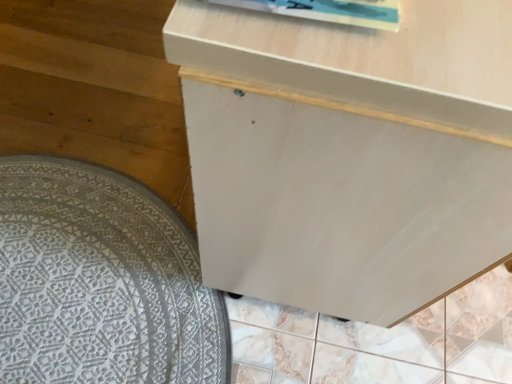
What do you see at coordinates (101, 282) in the screenshot?
I see `white textured mat at lower left` at bounding box center [101, 282].

Measure the distance between point (109, 172) and camera.

4.18 feet.

Locate an element on the screen. The height and width of the screenshot is (384, 512). white textured mat at lower left is located at coordinates (101, 282).

Describe the element at coordinates (348, 153) in the screenshot. I see `white matte cabinet at center` at that location.

Image resolution: width=512 pixels, height=384 pixels. I want to click on white matte cabinet at center, so click(348, 153).

What is the approximate width of white matte cabinet at center?

white matte cabinet at center is 19.67 inches in width.

Where is `white textured mat at lower left`? This screenshot has width=512, height=384. white textured mat at lower left is located at coordinates pos(101,282).

Is white matte cabinet at center at the left side of white textured mat at lower left?

No.

Is the position of white matte cabinet at center more distant than that of white textured mat at lower left?

No, it is in front of white textured mat at lower left.

Between point (327, 147) and point (86, 375), which one is positioned behind?

The point (86, 375) is farther from the camera.

From the image's perspective, is white matte cabinet at center above or below white textured mat at lower left?

From the image's perspective, white matte cabinet at center appears above white textured mat at lower left.

From a real-world perspective, between white matte cabinet at center and white textured mat at lower left, who is vertically higher?

white matte cabinet at center, from a real-world perspective.

Which of these two, white matte cabinet at center or white textured mat at lower left, is wider?

Wider between the two is white textured mat at lower left.

Does white matte cabinet at center have a greater height compared to white textured mat at lower left?

Indeed, white matte cabinet at center has a greater height compared to white textured mat at lower left.

In terms of size, does white matte cabinet at center appear bigger or smaller than white textured mat at lower left?

Clearly, white matte cabinet at center is larger in size than white textured mat at lower left.

Which is correct: white matte cabinet at center is inside white textured mat at lower left, or outside of it?

The correct answer is: outside.

Are white matte cabinet at center and white textured mat at lower left making contact?

There is a gap between white matte cabinet at center and white textured mat at lower left.

Does white matte cabinet at center turn towards white textured mat at lower left?

No, white matte cabinet at center is not turned towards white textured mat at lower left.

Measure the distance from white matte cabinet at center to white textured mat at lower left.

A distance of 20.42 inches exists between white matte cabinet at center and white textured mat at lower left.

Identify the location of furniture lying on the right of white textured mat at lower left. (348, 153).

Does white textured mat at lower left appear on the left side of white matte cabinet at center?

Yes, white textured mat at lower left is to the left of white matte cabinet at center.

Relative to white matte cabinet at center, is white textured mat at lower left in front or behind?

In the image, white textured mat at lower left appears behind white matte cabinet at center.

Considering the positions of point (134, 335) and point (472, 6), is point (134, 335) closer or farther from the camera than point (472, 6)?

Clearly, point (134, 335) is more distant from the camera than point (472, 6).

From the image's perspective, is white textured mat at lower left under white matte cabinet at center?

Yes, from the image's perspective, white textured mat at lower left is below white matte cabinet at center.

From a real-world perspective, which object rests below the other?

white textured mat at lower left is physically lower.

Is white textured mat at lower left wider or thinner than white matte cabinet at center?

Clearly, white textured mat at lower left has more width compared to white matte cabinet at center.

Considering the sizes of white textured mat at lower left and white matte cabinet at center in the image, is white textured mat at lower left taller or shorter than white matte cabinet at center?

In the image, white textured mat at lower left appears to be shorter than white matte cabinet at center.

Is white textured mat at lower left bigger than white matte cabinet at center?

No, white textured mat at lower left is not bigger than white matte cabinet at center.

Is white textured mat at lower left inside the boundaries of white matte cabinet at center, or outside?

white textured mat at lower left exists outside the volume of white matte cabinet at center.

Is the surface of white textured mat at lower left in direct contact with white matte cabinet at center?

No, white textured mat at lower left is not in contact with white matte cabinet at center.

Does white textured mat at lower left turn towards white matte cabinet at center?

No, white textured mat at lower left is not aimed at white matte cabinet at center.

What's the angular difference between white textured mat at lower left and white matte cabinet at center's facing directions?

white textured mat at lower left and white matte cabinet at center are facing 4.35 degrees away from each other.

This screenshot has width=512, height=384. I want to click on mat below the white matte cabinet at center (from a real-world perspective), so click(101, 282).

Identify the location of mat that appears on the left of white matte cabinet at center. (101, 282).

Identify the location of mat that appears below the white matte cabinet at center (from a real-world perspective). click(x=101, y=282).